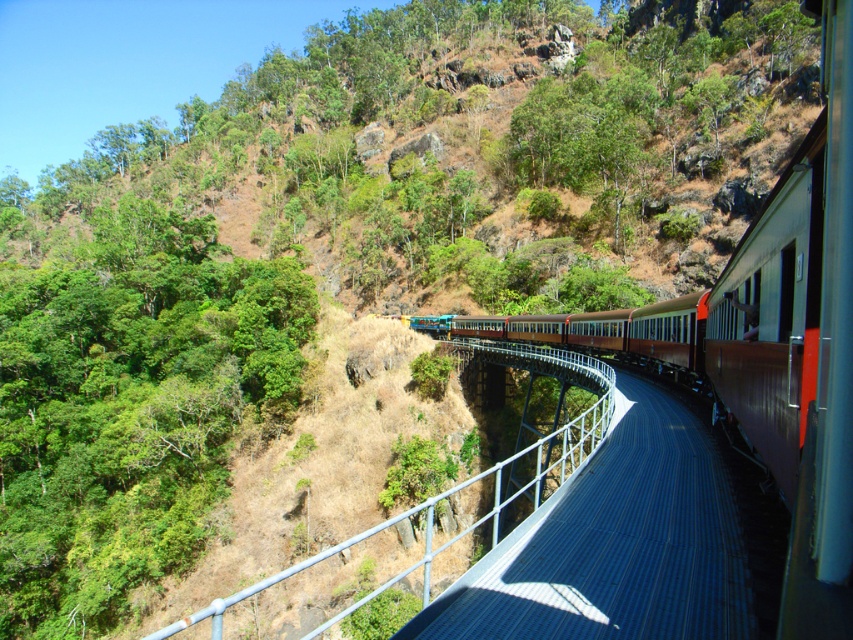
You are standing at the point marked by coordinates point (799,346) in the image. What object are you directly facing?

The point (799,346) indicates brown metal train at center, so you are directly facing the brown metal train at center.

You are a passenger on the train and want to take a photo of the scenic valley below. You notice the brown metal train at center and the metallic blue rail at center. Which object should you avoid blocking in your photo to ensure the valley is fully visible?

You should avoid blocking the metallic blue rail at center because the brown metal train at center is positioned to its right, potentially obscuring the view of the valley if the train is in the frame.

You are a passenger on the brown metal train at center and want to look out the window to see the metallic blue rail at center. Based on their sizes, which object will appear closer to you?

The brown metal train at center is smaller in size compared to the metallic blue rail at center, so the metallic blue rail at center will appear closer to you.